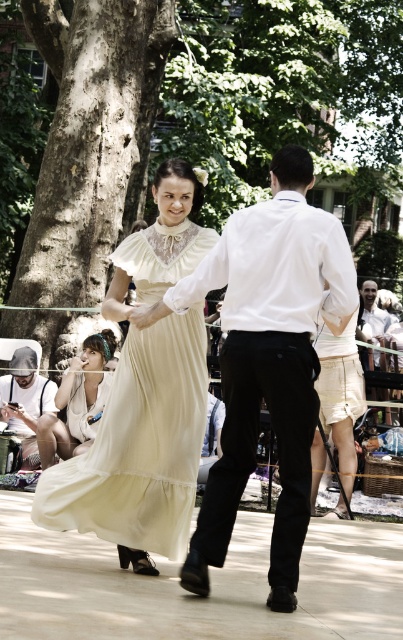
Question: Among these objects, which one is nearest to the camera?

Choices:
 (A) smooth white shirt at center
 (B) denim cap at left
 (C) white cotton shirt at center
 (D) matte cream dress at center

Answer: (C)

Question: Is white cotton shirt at center positioned at the back of white lace dress at lower left?

Choices:
 (A) no
 (B) yes

Answer: (A)

Question: Among these objects, which one is farthest from the camera?

Choices:
 (A) matte cream dress at center
 (B) white cotton shirt at center
 (C) white lace dress at lower left

Answer: (C)

Question: From the image, what is the correct spatial relationship of matte cream dress at center in relation to denim cap at left?

Choices:
 (A) below
 (B) above

Answer: (B)

Question: Is matte cream dress at center further to the viewer compared to denim cap at left?

Choices:
 (A) no
 (B) yes

Answer: (A)

Question: Among these objects, which one is nearest to the camera?

Choices:
 (A) smooth white shirt at center
 (B) white cotton shirt at center
 (C) denim cap at left

Answer: (B)